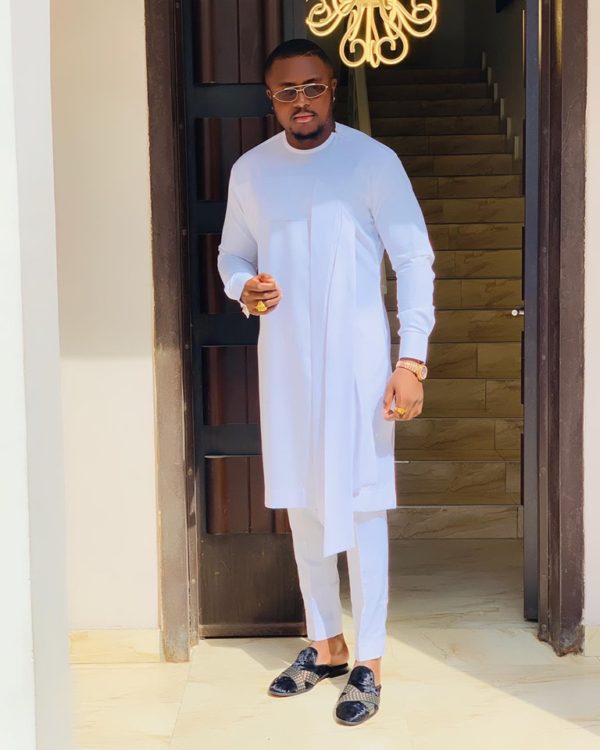
Where is `floor`? This screenshot has height=750, width=600. floor is located at coordinates (212, 704).